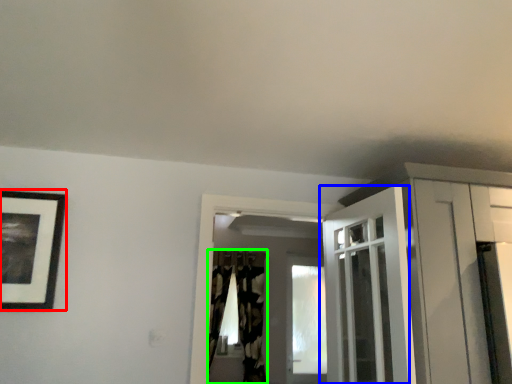
Question: Which object is positioned closest to picture frame (highlighted by a red box)? Select from door (highlighted by a blue box) and curtain (highlighted by a green box).

Choices:
 (A) door
 (B) curtain

Answer: (A)